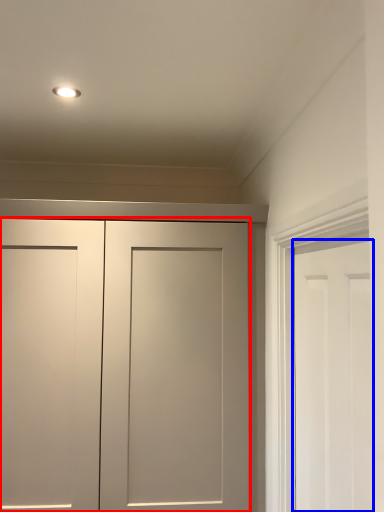
Question: Which of the following is the closest to the observer, door (highlighted by a red box) or door (highlighted by a blue box)?

Choices:
 (A) door
 (B) door

Answer: (B)